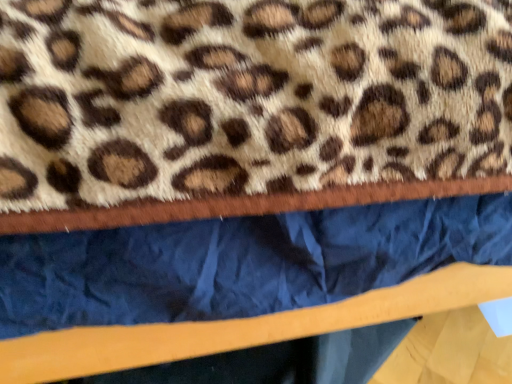
Where is `matte blue fabric at center`? Image resolution: width=512 pixels, height=384 pixels. matte blue fabric at center is located at coordinates (240, 262).

What do you see at coordinates (240, 262) in the screenshot? The image size is (512, 384). I see `matte blue fabric at center` at bounding box center [240, 262].

Where is `matte blue fabric at center`? This screenshot has width=512, height=384. matte blue fabric at center is located at coordinates (240, 262).